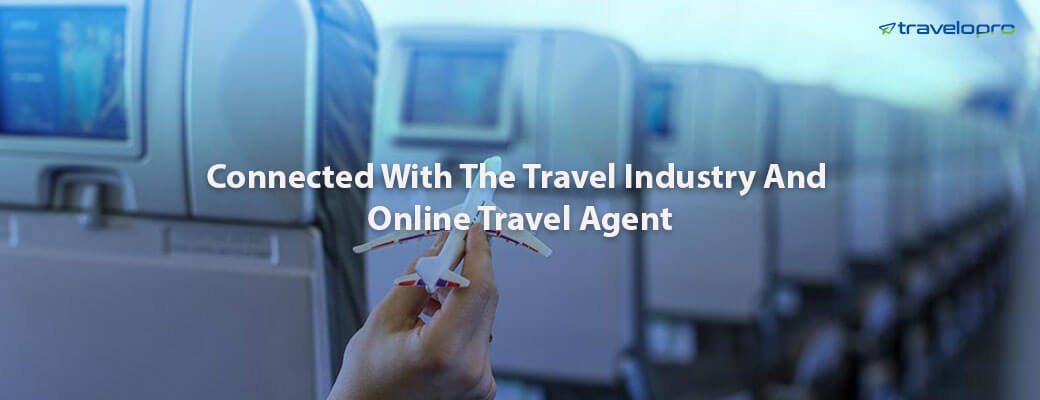
Image resolution: width=1040 pixels, height=400 pixels. In order to click on headrest in this screenshot , I will do `click(252, 84)`.